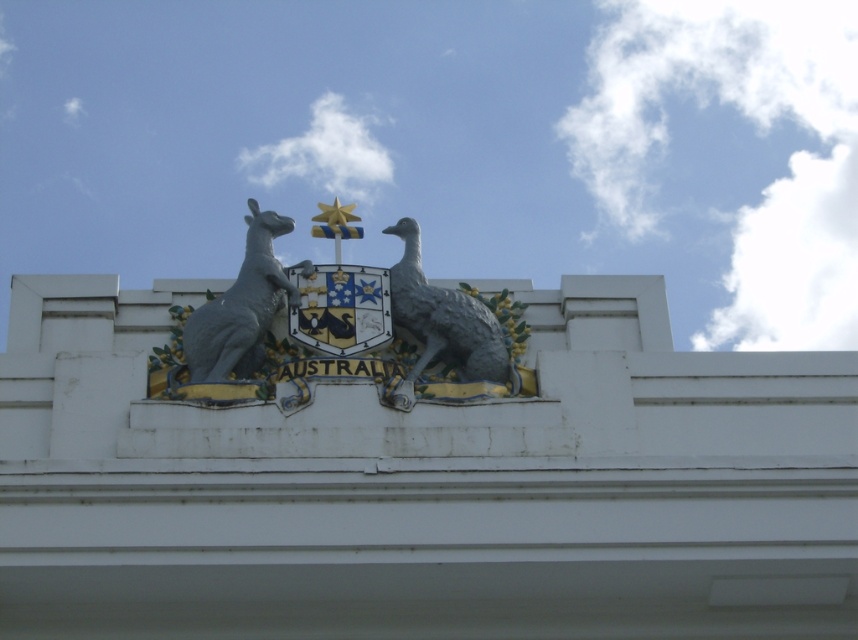
Question: Does gray metallic bird at center appear under gray metallic kangaroo at upper left?

Choices:
 (A) yes
 (B) no

Answer: (A)

Question: Among these objects, which one is nearest to the camera?

Choices:
 (A) gray metallic bird at center
 (B) gray metallic kangaroo at upper left

Answer: (A)

Question: Observing the image, what is the correct spatial positioning of gray metallic bird at center in reference to gray metallic kangaroo at upper left?

Choices:
 (A) left
 (B) right

Answer: (B)

Question: Which of the following is the closest to the observer?

Choices:
 (A) (390, 289)
 (B) (310, 266)

Answer: (B)

Question: Which object is farther from the camera taking this photo?

Choices:
 (A) gray metallic bird at center
 (B) gray metallic kangaroo at upper left

Answer: (B)

Question: Can you confirm if gray metallic bird at center is wider than gray metallic kangaroo at upper left?

Choices:
 (A) no
 (B) yes

Answer: (B)